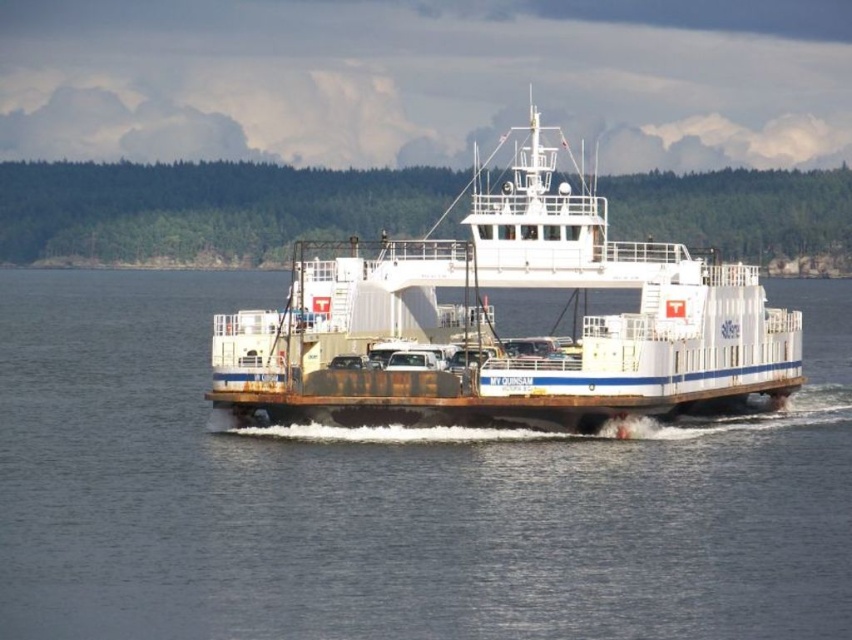
Question: Which of the following is the farthest from the observer?

Choices:
 (A) (584, 232)
 (B) (671, 586)

Answer: (A)

Question: Can you confirm if white matte water at center is positioned below white matte ferry at center?

Choices:
 (A) no
 (B) yes

Answer: (B)

Question: Can you confirm if white matte water at center is positioned to the right of white matte ferry at center?

Choices:
 (A) no
 (B) yes

Answer: (B)

Question: Which point is closer to the camera?

Choices:
 (A) (492, 497)
 (B) (348, 289)

Answer: (A)

Question: Is white matte water at center to the left of white matte ferry at center from the viewer's perspective?

Choices:
 (A) yes
 (B) no

Answer: (B)

Question: Which point is closer to the camera?

Choices:
 (A) (738, 552)
 (B) (556, 424)

Answer: (A)